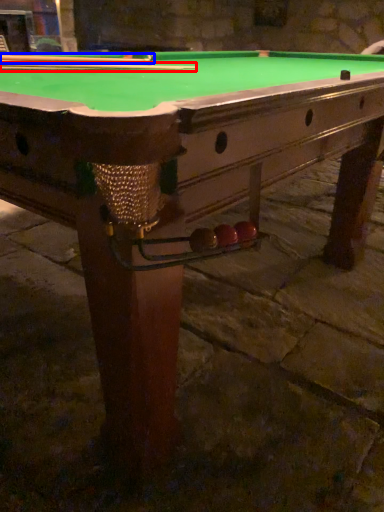
Question: Which object appears closest to the camera in this image, cue (highlighted by a red box) or cue (highlighted by a blue box)?

Choices:
 (A) cue
 (B) cue

Answer: (B)